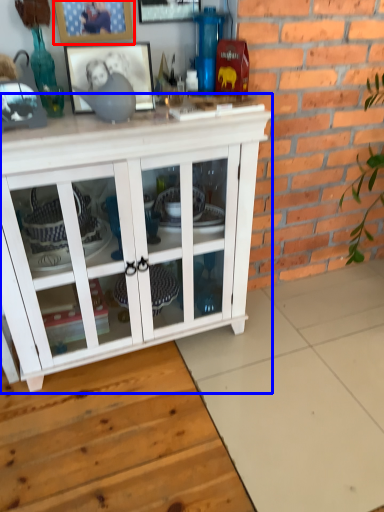
Question: Which point is further to the camera, picture frame (highlighted by a red box) or cabinetry (highlighted by a blue box)?

Choices:
 (A) picture frame
 (B) cabinetry

Answer: (A)